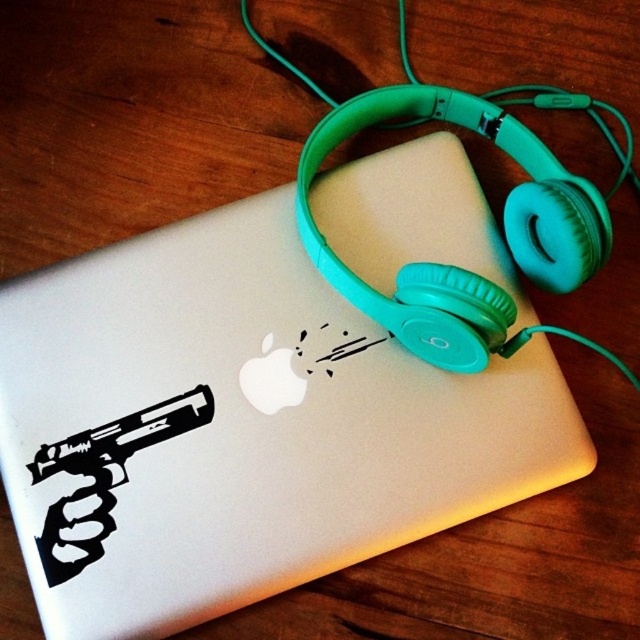
You are organizing a desk and want to stack the white matte laptop at center on top of the black vinyl sticker at lower left. Is this possible based on their sizes?

The white matte laptop at center has a greater height compared to the black vinyl sticker at lower left. Therefore, placing the laptop on top of the sticker would not be possible since the laptop is taller and might not provide a stable base.

You are organizing a desk and want to place the white matte laptop at center and the black vinyl sticker at lower left next to each other. Based on their sizes, which object should you place first to ensure they fit properly?

The white matte laptop at center is wider than the black vinyl sticker at lower left, so you should place the white matte laptop at center first to ensure there is enough space for both objects.

You are a person with a height of 1.7 meters standing in front of the white matte laptop at center. Can you comfortably reach the laptop without leaning forward?

The white matte laptop at center is 1.17 meters away from the viewer. Since the average comfortable reaching distance for a person of 1.7 meters is typically around 0.8 to 1.0 meters, the distance of 1.17 meters may require leaning forward to comfortably reach the white matte laptop at center.